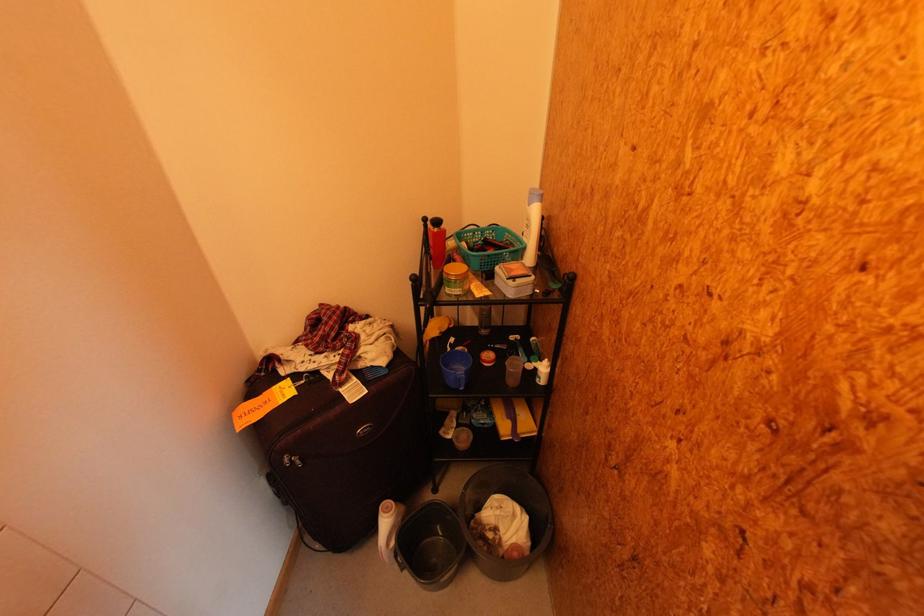
Identify the location of red bottle pump. The width and height of the screenshot is (924, 616). (436, 238).